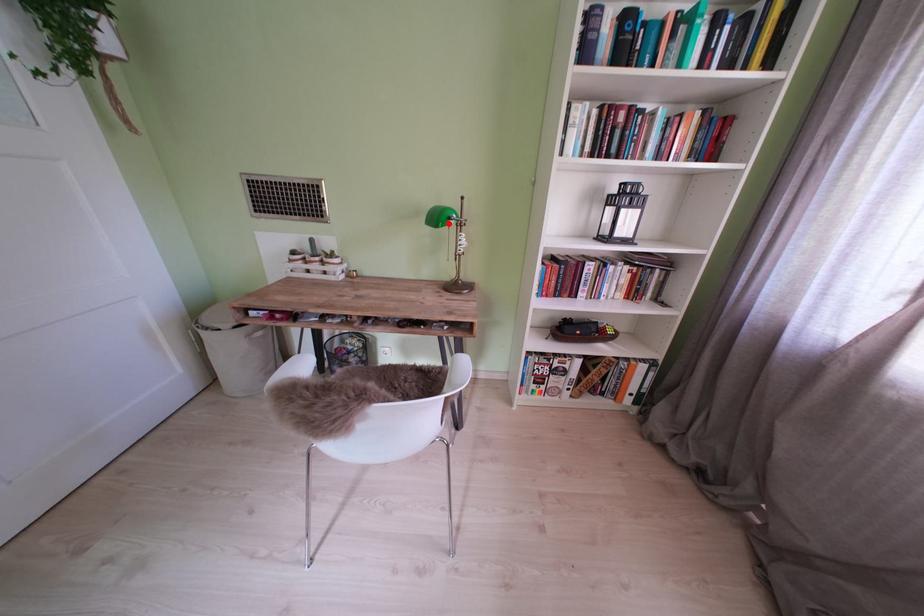
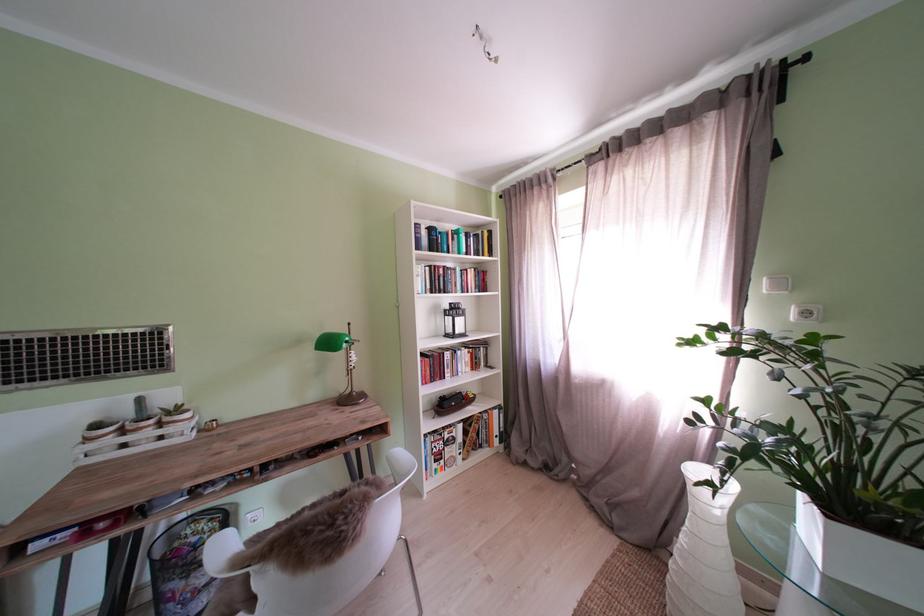
Where in the second image is the point corresponding to the highlighted location from the first image?

(341, 349)